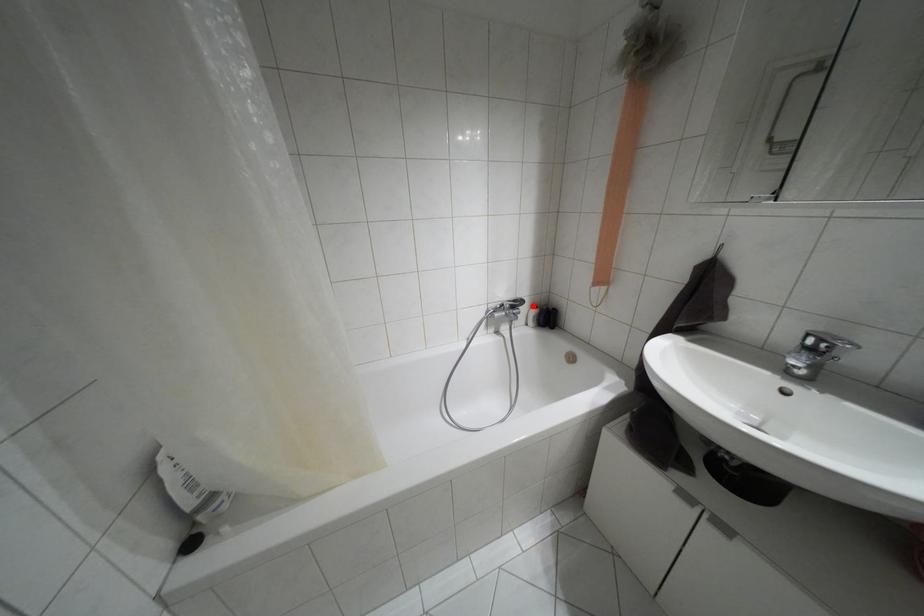
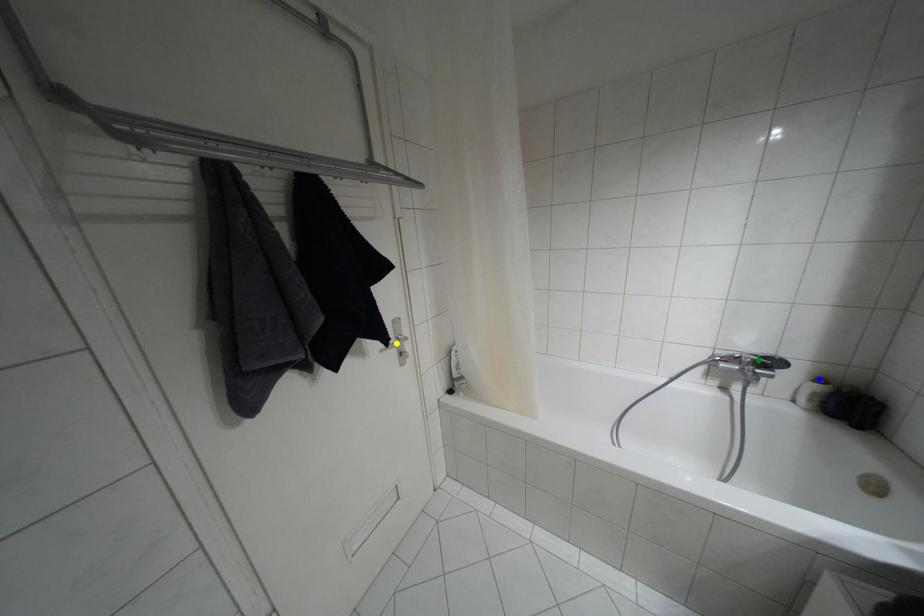
Question: I am providing you with two images of the same scene from different viewpoints. A red point is marked on the first image. You are given multiple points on the second image. Which point in image 2 is actually the same real-world point as the red point in image 1?

Choices:
 (A) green point
 (B) blue point
 (C) yellow point

Answer: (B)